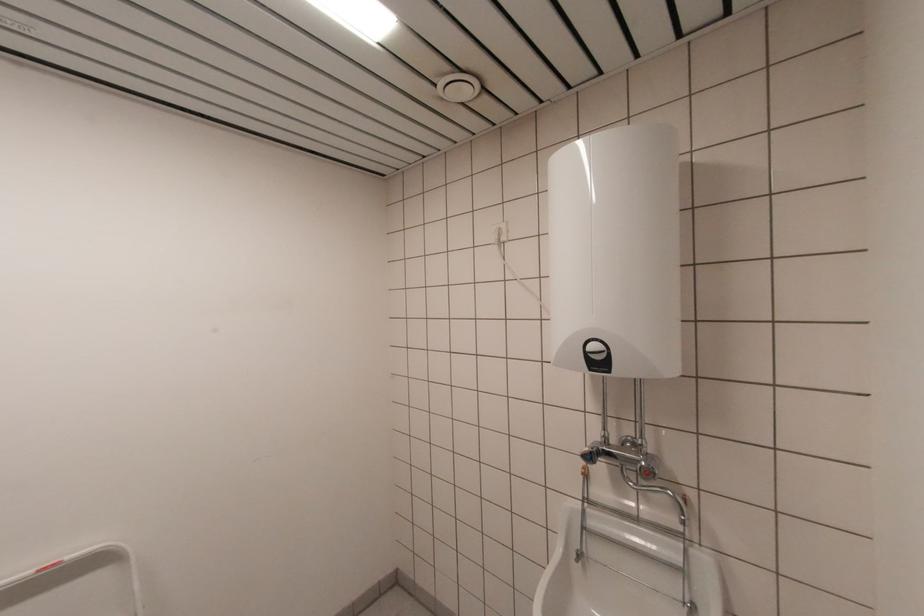
This screenshot has height=616, width=924. What do you see at coordinates (590, 455) in the screenshot?
I see `the blue valve handle` at bounding box center [590, 455].